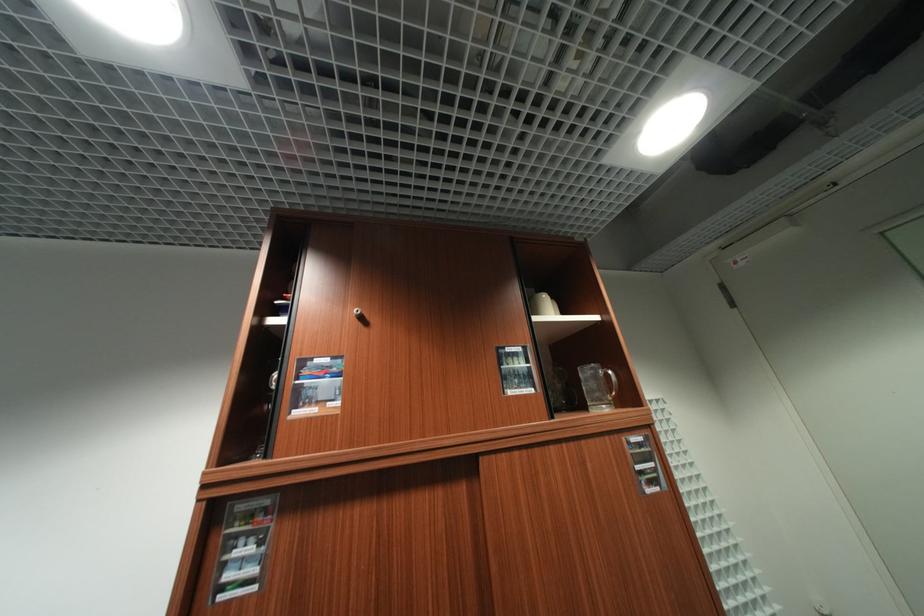
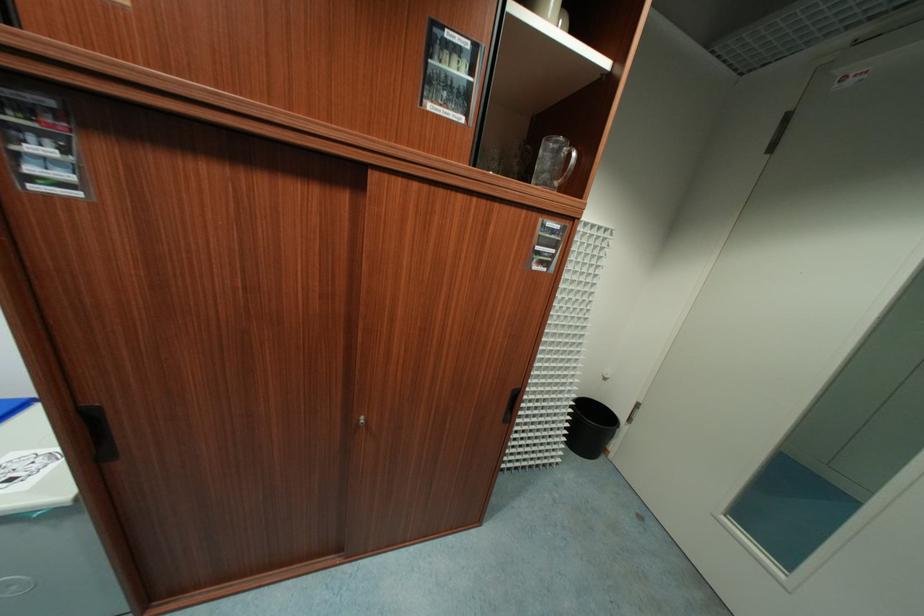
Question: The first image is from the beginning of the video and the second image is from the end. How did the camera likely rotate when shooting the video?

Choices:
 (A) Left
 (B) Right
 (C) Up
 (D) Down

Answer: (D)